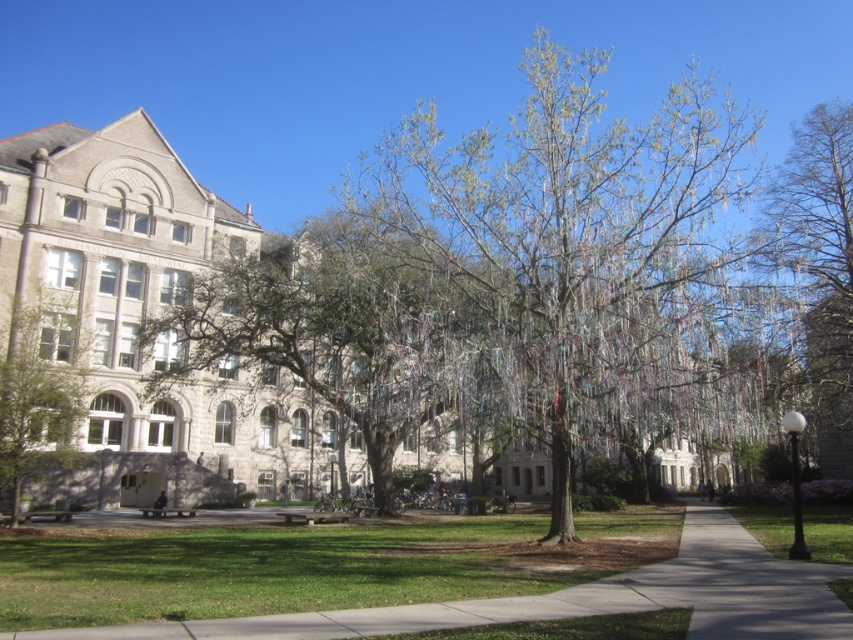
Can you confirm if green grass at center is taller than green leafy tree at left?

Incorrect, green grass at center's height is not larger of green leafy tree at left's.

Does green grass at center have a greater width compared to green leafy tree at left?

Yes, green grass at center is wider than green leafy tree at left.

Image resolution: width=853 pixels, height=640 pixels. Find the location of `green grass at center`. green grass at center is located at coordinates (308, 564).

Which is in front, point (323, 582) or point (767, 230)?

Point (323, 582) is more forward.

Locate an element on the screen. green grass at center is located at coordinates (308, 564).

Who is more distant from viewer, (544,579) or (843,458)?

Positioned behind is point (843,458).

At what (x,y) coordinates should I click in order to perform the action: click on green grass at center. Please return your answer as a coordinate pair (x, y). Looking at the image, I should click on (308, 564).

Who is lower down, green leafy tree at center or green grass at center?

green grass at center

Who is shorter, green leafy tree at center or green grass at center?

Standing shorter between the two is green grass at center.

Between point (648, 372) and point (78, 570), which one is positioned behind?

The point (648, 372) is behind.

Locate an element on the screen. green leafy tree at center is located at coordinates (575, 250).